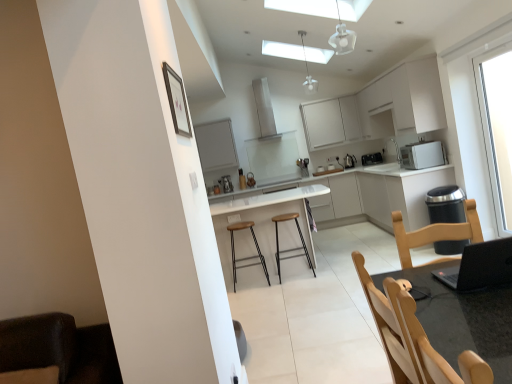
Question: Is black matte laptop at lower right completely or partially outside of white matte exhaust hood at upper center?

Choices:
 (A) no
 (B) yes

Answer: (B)

Question: Considering the relative sizes of black matte laptop at lower right and white matte exhaust hood at upper center in the image provided, is black matte laptop at lower right taller than white matte exhaust hood at upper center?

Choices:
 (A) yes
 (B) no

Answer: (B)

Question: Is black matte laptop at lower right positioned before white matte exhaust hood at upper center?

Choices:
 (A) yes
 (B) no

Answer: (A)

Question: Does black matte laptop at lower right have a lesser height compared to white matte exhaust hood at upper center?

Choices:
 (A) no
 (B) yes

Answer: (B)

Question: From a real-world perspective, is black matte laptop at lower right beneath white matte exhaust hood at upper center?

Choices:
 (A) no
 (B) yes

Answer: (B)

Question: Is black matte laptop at lower right behind white matte exhaust hood at upper center?

Choices:
 (A) no
 (B) yes

Answer: (A)

Question: From the image's perspective, would you say polished stainless steel kettle at center-right, placed as the third appliance when sorted from front to back, is shown under black plastic toaster at upper right, which is the 2th appliance in front-to-back order?

Choices:
 (A) no
 (B) yes

Answer: (B)

Question: Can you confirm if polished stainless steel kettle at center-right, positioned as the 1th appliance in back-to-front order, is thinner than black plastic toaster at upper right, which is the 2th appliance in front-to-back order?

Choices:
 (A) no
 (B) yes

Answer: (B)

Question: Can you confirm if polished stainless steel kettle at center-right, positioned as the 1th appliance in back-to-front order, is smaller than black plastic toaster at upper right, which is the 2th appliance in front-to-back order?

Choices:
 (A) no
 (B) yes

Answer: (B)

Question: Can you confirm if polished stainless steel kettle at center-right, placed as the third appliance when sorted from front to back, is positioned to the left of black plastic toaster at upper right, the 2th appliance positioned from the back?

Choices:
 (A) no
 (B) yes

Answer: (B)

Question: Is polished stainless steel kettle at center-right, placed as the third appliance when sorted from front to back, further to camera compared to black plastic toaster at upper right, the 2th appliance positioned from the back?

Choices:
 (A) yes
 (B) no

Answer: (A)

Question: Is polished stainless steel kettle at center-right, positioned as the 1th appliance in back-to-front order, far away from black plastic toaster at upper right, the 2th appliance positioned from the back?

Choices:
 (A) no
 (B) yes

Answer: (A)

Question: Can you confirm if metallic silver bar stool at center, which appears as the 1th bar stool when viewed from the right, is positioned to the left of black plastic toaster at upper right, which is the 2th appliance in front-to-back order?

Choices:
 (A) yes
 (B) no

Answer: (A)